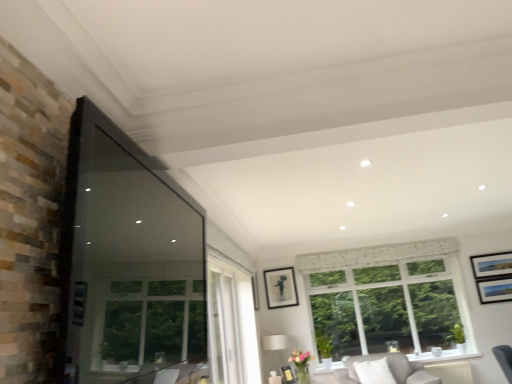
Measure the distance between white lace curtain at upper center and camera.

The distance of white lace curtain at upper center from camera is 5.88 meters.

What are the coordinates of `matte black picture frame at center, which is the 3th picture frame from bottom to top` in the screenshot? It's located at (255, 292).

How much space does black glossy picture frame at center, placed as the second picture frame when sorted from bottom to top, occupy vertically?

22.45 inches.

I want to click on white lace curtain at upper center, so click(376, 255).

Is matte black picture frame at lower center, which is counted as the 3th picture frame, starting from the top, directly adjacent to light gray fabric couch at lower right?

No.

Can you tell me how much matte black picture frame at lower center, which is counted as the 3th picture frame, starting from the top, and light gray fabric couch at lower right differ in facing direction?

matte black picture frame at lower center, which is counted as the 3th picture frame, starting from the top, and light gray fabric couch at lower right are facing 33.9 degrees away from each other.

Can you confirm if matte black picture frame at lower center, which is counted as the 3th picture frame, starting from the top, is positioned to the right of light gray fabric couch at lower right?

No, matte black picture frame at lower center, which is counted as the 3th picture frame, starting from the top, is not to the right of light gray fabric couch at lower right.

From the image's perspective, is matte black picture frame at lower center, which is the first picture frame in bottom-to-top order, above or below light gray fabric couch at lower right?

Based on their image positions, matte black picture frame at lower center, which is the first picture frame in bottom-to-top order, is located above light gray fabric couch at lower right.

Could you tell me if light gray fabric couch at lower right is turned towards matte white lampshade at center?

No.

Would you say matte white lampshade at center is part of light gray fabric couch at lower right's contents?

No, matte white lampshade at center is not a part of light gray fabric couch at lower right.

Considering the sizes of objects light gray fabric couch at lower right and matte white lampshade at center in the image provided, who is smaller, light gray fabric couch at lower right or matte white lampshade at center?

With smaller size is light gray fabric couch at lower right.

Is point (418, 379) positioned behind point (271, 346)?

No, it is not.

Where is `the 1st picture frame counting from the right of the matte black picture frame at center, which is the 3th picture frame from bottom to top`? The height and width of the screenshot is (384, 512). the 1st picture frame counting from the right of the matte black picture frame at center, which is the 3th picture frame from bottom to top is located at coordinates 280,288.

Can you confirm if matte black picture frame at center, the first picture frame in the top-to-bottom sequence, is bigger than black glossy picture frame at center, the second picture frame from the top?

Incorrect, matte black picture frame at center, the first picture frame in the top-to-bottom sequence, is not larger than black glossy picture frame at center, the second picture frame from the top.

Is matte black picture frame at center, which is the 3th picture frame from bottom to top, directly adjacent to black glossy picture frame at center, the second picture frame from the top?

No, matte black picture frame at center, which is the 3th picture frame from bottom to top, is not beside black glossy picture frame at center, the second picture frame from the top.

From a real-world perspective, is matte black picture frame at center, the first picture frame in the top-to-bottom sequence, above or below black glossy picture frame at center, placed as the second picture frame when sorted from bottom to top?

Clearly, from a real-world perspective, matte black picture frame at center, the first picture frame in the top-to-bottom sequence, is below black glossy picture frame at center, placed as the second picture frame when sorted from bottom to top.

From the image's perspective, which object appears higher, matte black picture frame at lower center, which is the first picture frame in bottom-to-top order, or matte black picture frame at center, the first picture frame in the top-to-bottom sequence?

matte black picture frame at center, the first picture frame in the top-to-bottom sequence, is shown above in the image.

Could matte black picture frame at center, which is the 3th picture frame from bottom to top, be considered to be inside matte black picture frame at lower center, which is the first picture frame in bottom-to-top order?

No, matte black picture frame at center, which is the 3th picture frame from bottom to top, is located outside of matte black picture frame at lower center, which is the first picture frame in bottom-to-top order.

Which of these two, matte black picture frame at lower center, which is the first picture frame in bottom-to-top order, or matte black picture frame at center, which is the 3th picture frame from bottom to top, stands taller?

With more height is matte black picture frame at center, which is the 3th picture frame from bottom to top.

Is matte black picture frame at lower center, which is the first picture frame in bottom-to-top order, in front of or behind matte black picture frame at center, which is the 3th picture frame from bottom to top, in the image?

matte black picture frame at lower center, which is the first picture frame in bottom-to-top order, is positioned closer to the viewer than matte black picture frame at center, which is the 3th picture frame from bottom to top.

In the image, is black glossy picture frame at center, placed as the second picture frame when sorted from bottom to top, positioned in front of or behind white lace curtain at upper center?

Visually, black glossy picture frame at center, placed as the second picture frame when sorted from bottom to top, is located behind white lace curtain at upper center.

From the image's perspective, between black glossy picture frame at center, the second picture frame from the top, and white lace curtain at upper center, who is located below?

black glossy picture frame at center, the second picture frame from the top.

Is there a large distance between black glossy picture frame at center, the second picture frame from the top, and white lace curtain at upper center?

Actually, black glossy picture frame at center, the second picture frame from the top, and white lace curtain at upper center are a little close together.

Is black glossy picture frame at center, placed as the second picture frame when sorted from bottom to top, oriented away from white lace curtain at upper center?

black glossy picture frame at center, placed as the second picture frame when sorted from bottom to top, is not turned away from white lace curtain at upper center.

You are a GUI agent. You are given a task and a screenshot of the screen. Output one action in this format:
    pyautogui.click(x=<x>, y=<y>)
    Task: Click on the couch located underneath the black glossy picture frame at center, placed as the second picture frame when sorted from bottom to top (from a real-world perspective)
    
    Given the screenshot: What is the action you would take?
    pyautogui.click(x=390, y=369)

From a real-world perspective, which object stands above the other?

black glossy picture frame at center, placed as the second picture frame when sorted from bottom to top, from a real-world perspective.

Does black glossy picture frame at center, placed as the second picture frame when sorted from bottom to top, appear on the left side of light gray fabric couch at lower right?

Yes, black glossy picture frame at center, placed as the second picture frame when sorted from bottom to top, is to the left of light gray fabric couch at lower right.

From the image's perspective, is light gray fabric couch at lower right above black glossy picture frame at center, the second picture frame from the top?

No, from the image's perspective, light gray fabric couch at lower right is not on top of black glossy picture frame at center, the second picture frame from the top.

Is light gray fabric couch at lower right not close to black glossy picture frame at center, placed as the second picture frame when sorted from bottom to top?

light gray fabric couch at lower right is far away from black glossy picture frame at center, placed as the second picture frame when sorted from bottom to top.

Between light gray fabric couch at lower right and black glossy picture frame at center, the second picture frame from the top, which one appears on the right side from the viewer's perspective?

Positioned to the right is light gray fabric couch at lower right.

From a real-world perspective, who is located lower, light gray fabric couch at lower right or black glossy picture frame at center, placed as the second picture frame when sorted from bottom to top?

light gray fabric couch at lower right, from a real-world perspective.

From the light gray fabric couch at lower right, count the 1st picture frame to the left and point to it. Please provide its 2D coordinates.

[(288, 375)]

Identify the location of lamp behind the light gray fabric couch at lower right. (275, 344).

Which object lies further to the anchor point matte black picture frame at center, which is the 3th picture frame from bottom to top, transparent glass window screen at left or light gray fabric couch at lower right?

transparent glass window screen at left is further to matte black picture frame at center, which is the 3th picture frame from bottom to top.

Based on their spatial positions, is matte black picture frame at lower center, which is counted as the 3th picture frame, starting from the top, or matte white lampshade at center closer to black glossy picture frame at center, the second picture frame from the top?

matte white lampshade at center.

Consider the image. Looking at the image, which one is located further to matte black picture frame at center, which is the 3th picture frame from bottom to top, transparent glass window screen at left or white lace curtain at upper center?

transparent glass window screen at left.

From the image, which object appears to be nearer to matte black picture frame at lower center, which is counted as the 3th picture frame, starting from the top, white lace curtain at upper center or matte white lampshade at center?

Among the two, matte white lampshade at center is located nearer to matte black picture frame at lower center, which is counted as the 3th picture frame, starting from the top.

Which object lies further to the anchor point light gray fabric couch at lower right, matte black picture frame at lower center, which is the first picture frame in bottom-to-top order, or black glossy picture frame at center, the second picture frame from the top?

black glossy picture frame at center, the second picture frame from the top, is positioned further to the anchor light gray fabric couch at lower right.

Considering their positions, is black glossy picture frame at center, the second picture frame from the top, positioned further to transparent glass window screen at left than matte white lampshade at center?

black glossy picture frame at center, the second picture frame from the top, is further to transparent glass window screen at left.

Looking at the image, which one is located closer to matte black picture frame at center, the first picture frame in the top-to-bottom sequence, light gray fabric couch at lower right or matte black picture frame at lower center, which is counted as the 3th picture frame, starting from the top?

matte black picture frame at lower center, which is counted as the 3th picture frame, starting from the top, is closer to matte black picture frame at center, the first picture frame in the top-to-bottom sequence.

Estimate the real-world distances between objects in this image. Which object is further from light gray fabric couch at lower right, matte black picture frame at lower center, which is counted as the 3th picture frame, starting from the top, or matte black picture frame at center, which is the 3th picture frame from bottom to top?

matte black picture frame at center, which is the 3th picture frame from bottom to top.

I want to click on picture frame located between transparent glass window screen at left and matte white lampshade at center in the depth direction, so click(x=288, y=375).

This screenshot has height=384, width=512. Identify the location of lamp that lies between matte black picture frame at center, the first picture frame in the top-to-bottom sequence, and matte black picture frame at lower center, which is counted as the 3th picture frame, starting from the top, from top to bottom. (275, 344).

This screenshot has width=512, height=384. What are the coordinates of `lamp between matte black picture frame at center, the first picture frame in the top-to-bottom sequence, and light gray fabric couch at lower right` in the screenshot? It's located at (275, 344).

Image resolution: width=512 pixels, height=384 pixels. Identify the location of picture frame positioned between transparent glass window screen at left and matte black picture frame at center, which is the 3th picture frame from bottom to top, from near to far. (288, 375).